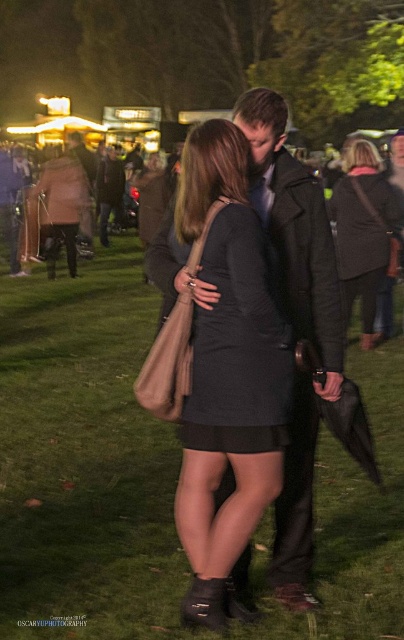
Is black matte dress at center to the left of dark gray dress at center from the viewer's perspective?

Indeed, black matte dress at center is positioned on the left side of dark gray dress at center.

Is black matte dress at center thinner than dark gray dress at center?

Indeed, black matte dress at center has a lesser width compared to dark gray dress at center.

The image size is (404, 640). I want to click on black matte dress at center, so click(x=239, y=346).

Where is `black matte dress at center`? The height and width of the screenshot is (640, 404). black matte dress at center is located at coordinates (239, 346).

Which is more to the right, green grass at center or matte black dress at center?

Positioned to the right is matte black dress at center.

Can you confirm if green grass at center is smaller than matte black dress at center?

Correct, green grass at center occupies less space than matte black dress at center.

This screenshot has height=640, width=404. Describe the element at coordinates (84, 460) in the screenshot. I see `green grass at center` at that location.

Image resolution: width=404 pixels, height=640 pixels. I want to click on green grass at center, so click(84, 460).

Can you confirm if green grass at center is taller than dark gray dress at center?

In fact, green grass at center may be shorter than dark gray dress at center.

Does green grass at center come in front of dark gray dress at center?

That is True.

This screenshot has height=640, width=404. What do you see at coordinates (84, 460) in the screenshot?
I see `green grass at center` at bounding box center [84, 460].

This screenshot has height=640, width=404. Identify the location of green grass at center. (84, 460).